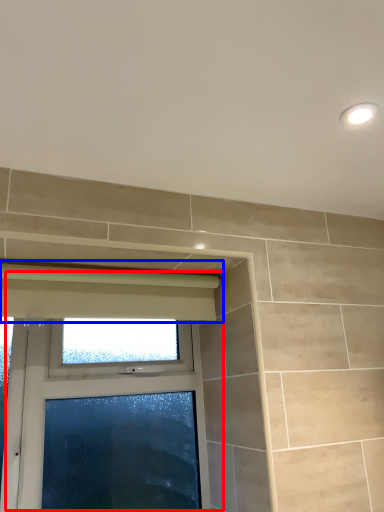
Question: Among these objects, which one is farthest to the camera, window (highlighted by a red box) or curtain (highlighted by a blue box)?

Choices:
 (A) window
 (B) curtain

Answer: (A)